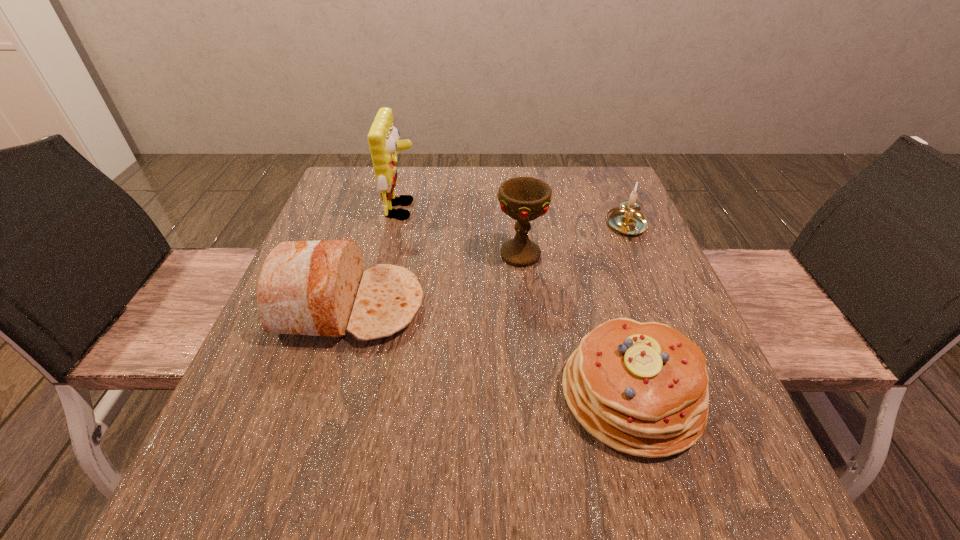
Locate an element on the screen. free region at the far left corner is located at coordinates (346, 168).

In the image, there is a desktop. Where is `vacant space at the near left corner`? The height and width of the screenshot is (540, 960). vacant space at the near left corner is located at coordinates (285, 484).

I want to click on free region at the far right corner, so click(612, 201).

This screenshot has width=960, height=540. In the image, there is a desktop. Identify the location of free space at the near right corner. (662, 473).

Locate an element on the screen. Image resolution: width=960 pixels, height=540 pixels. empty location between the candle holder and the chalice is located at coordinates (574, 240).

This screenshot has width=960, height=540. Identify the location of free space between the pancake and the bread. (491, 350).

The height and width of the screenshot is (540, 960). Find the location of `vacant space that is in between the fourth shortest object and the pancake`. vacant space that is in between the fourth shortest object and the pancake is located at coordinates (576, 325).

The width and height of the screenshot is (960, 540). What are the coordinates of `vacant area that lies between the chalice and the tallest object` in the screenshot? It's located at (462, 233).

At what (x,y) coordinates should I click in order to perform the action: click on vacant space that is in between the bread and the sponge. Please return your answer as a coordinate pair (x, y). Looking at the image, I should click on (376, 258).

Where is `unoccupied area between the sponge and the fourth shortest object`? The height and width of the screenshot is (540, 960). unoccupied area between the sponge and the fourth shortest object is located at coordinates (462, 233).